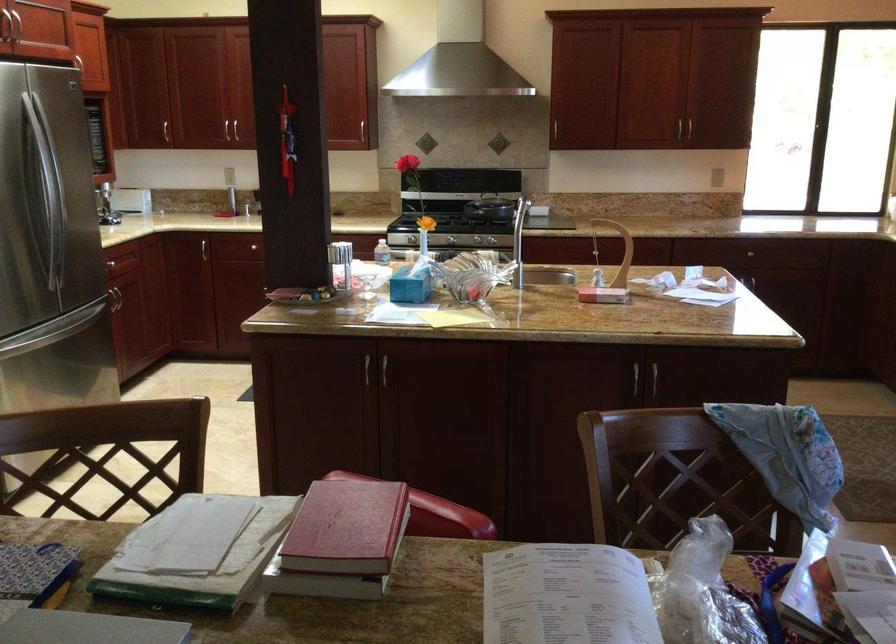
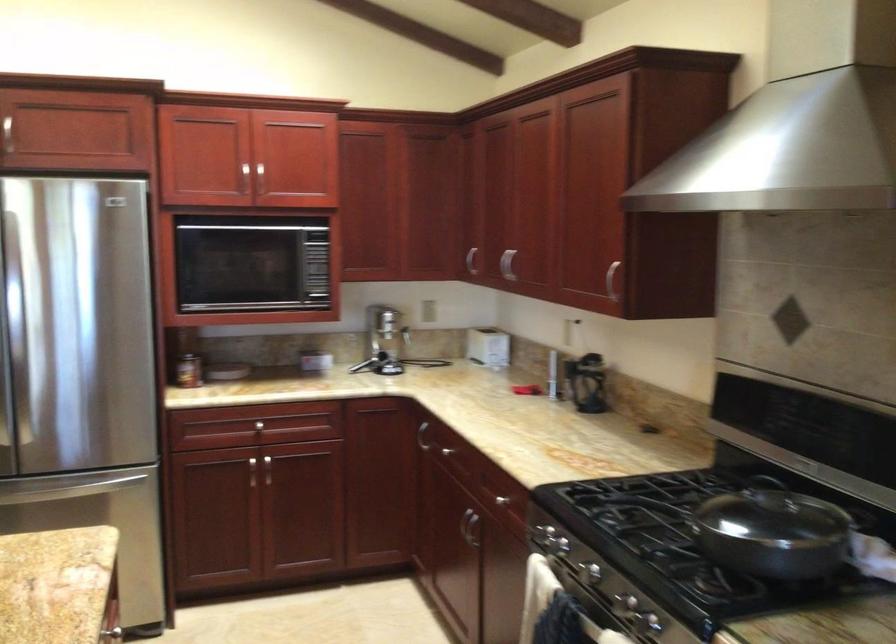
The point at [159,245] is marked in the first image. Where is the corresponding point in the second image?

(421, 436)